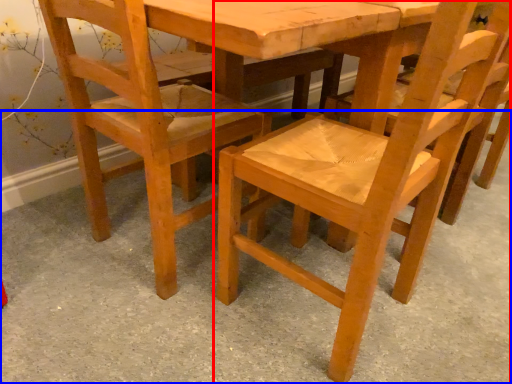
Question: Which point is further to the camera, chair (highlighted by a red box) or concrete (highlighted by a blue box)?

Choices:
 (A) chair
 (B) concrete

Answer: (A)